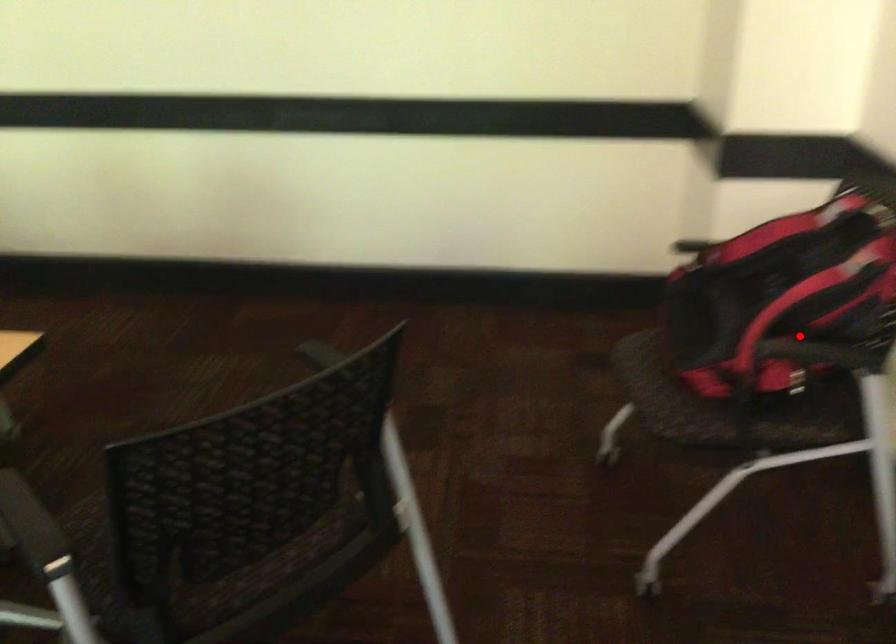
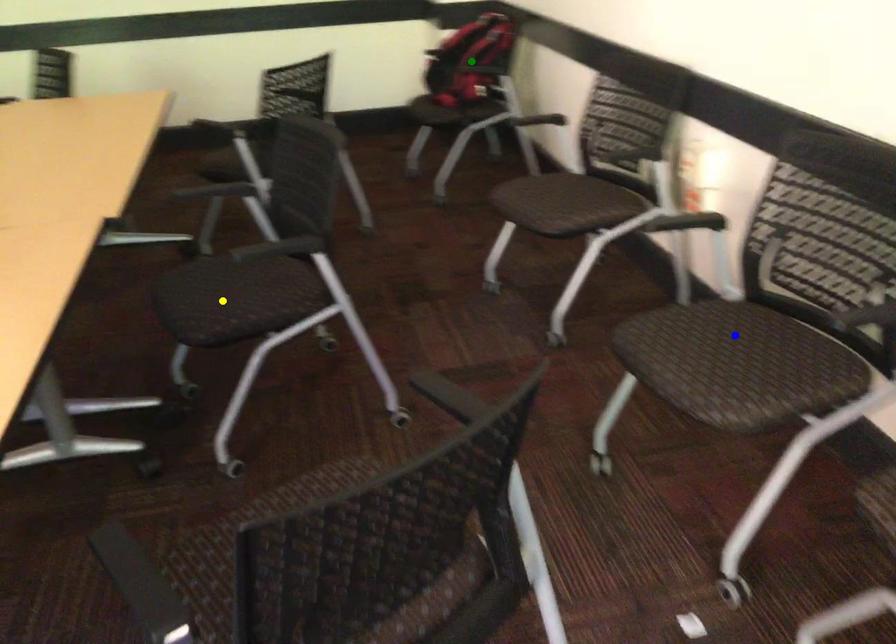
Question: I am providing you with two images of the same scene from different viewpoints. A red point is marked on the first image. You are given multiple points on the second image. Which spot in image 2 lines up with the point in image 1?

Choices:
 (A) blue point
 (B) green point
 (C) yellow point

Answer: (B)